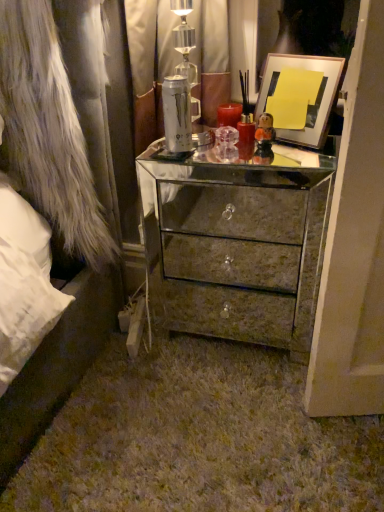
Question: Can you confirm if white fur coat at left is wider than metallic silver picture frame at upper right?

Choices:
 (A) yes
 (B) no

Answer: (A)

Question: Does white fur coat at left have a lesser width compared to metallic silver picture frame at upper right?

Choices:
 (A) yes
 (B) no

Answer: (B)

Question: Is white fur coat at left at the left side of metallic silver picture frame at upper right?

Choices:
 (A) yes
 (B) no

Answer: (A)

Question: Is white fur coat at left bigger than metallic silver picture frame at upper right?

Choices:
 (A) no
 (B) yes

Answer: (B)

Question: Can you confirm if white fur coat at left is shorter than metallic silver picture frame at upper right?

Choices:
 (A) no
 (B) yes

Answer: (A)

Question: Considering the positions of white fur coat at left and metallic silver picture frame at upper right in the image, is white fur coat at left taller or shorter than metallic silver picture frame at upper right?

Choices:
 (A) short
 (B) tall

Answer: (B)

Question: Considering the relative positions of white fur coat at left and metallic silver picture frame at upper right in the image provided, is white fur coat at left to the left or to the right of metallic silver picture frame at upper right?

Choices:
 (A) right
 (B) left

Answer: (B)

Question: In terms of width, does white fur coat at left look wider or thinner when compared to metallic silver picture frame at upper right?

Choices:
 (A) thin
 (B) wide

Answer: (B)

Question: Is point (41, 37) closer or farther from the camera than point (284, 106)?

Choices:
 (A) closer
 (B) farther

Answer: (A)

Question: Relative to metallic silver picture frame at upper right, is mirrored metallic chest of drawers at center in front or behind?

Choices:
 (A) behind
 (B) front

Answer: (B)

Question: Is mirrored metallic chest of drawers at center spatially inside metallic silver picture frame at upper right, or outside of it?

Choices:
 (A) inside
 (B) outside

Answer: (B)

Question: From their relative heights in the image, would you say mirrored metallic chest of drawers at center is taller or shorter than metallic silver picture frame at upper right?

Choices:
 (A) short
 (B) tall

Answer: (B)

Question: From the image's perspective, is mirrored metallic chest of drawers at center above or below metallic silver picture frame at upper right?

Choices:
 (A) below
 (B) above

Answer: (A)

Question: Looking at their shapes, would you say metallic silver picture frame at upper right is wider or thinner than mirrored metallic chest of drawers at center?

Choices:
 (A) thin
 (B) wide

Answer: (A)

Question: From a real-world perspective, relative to mirrored metallic chest of drawers at center, is metallic silver picture frame at upper right vertically above or below?

Choices:
 (A) below
 (B) above

Answer: (B)